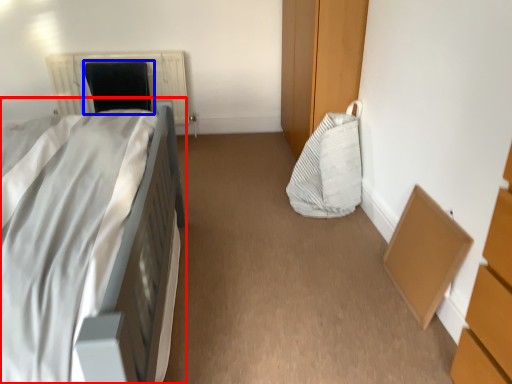
Question: Among these objects, which one is nearest to the camera, bed (highlighted by a red box) or bean bag chair (highlighted by a blue box)?

Choices:
 (A) bed
 (B) bean bag chair

Answer: (A)